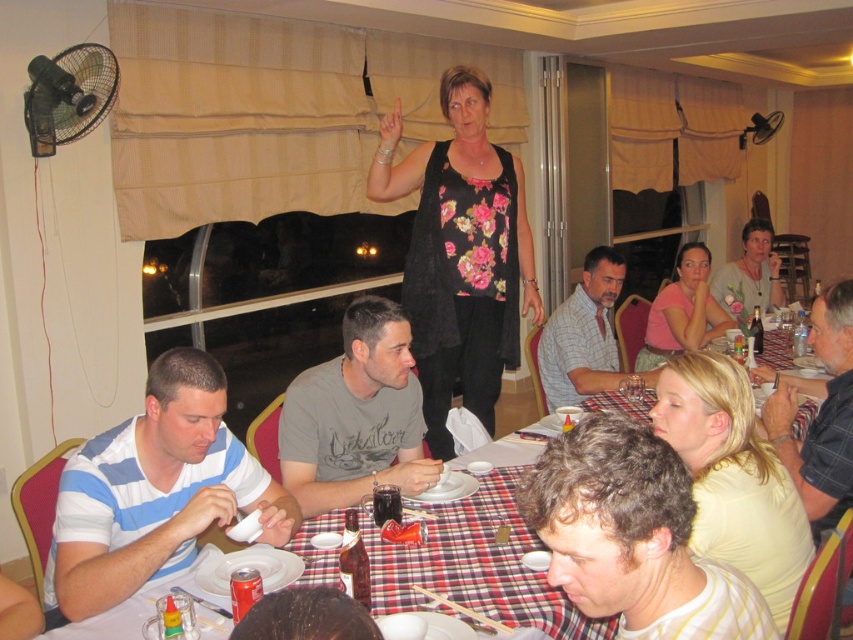
Question: Observing the image, what is the correct spatial positioning of floral print dress at center in reference to yellow cotton shirt at lower right?

Choices:
 (A) above
 (B) below

Answer: (A)

Question: Which of the following is the closest to the observer?

Choices:
 (A) (567, 396)
 (B) (659, 300)

Answer: (A)

Question: Estimate the real-world distances between objects in this image. Which object is farther from the pink matte shirt at lower right?

Choices:
 (A) floral fabric dress at upper center
 (B) plaid shirt at center
 (C) yellow cotton shirt at lower right

Answer: (C)

Question: Based on their relative distances, which object is farther from the plaid shirt at center?

Choices:
 (A) yellow cotton shirt at lower right
 (B) gray cotton shirt at center

Answer: (B)

Question: Is blue striped shirt at lower left thinner than pink matte shirt at lower right?

Choices:
 (A) no
 (B) yes

Answer: (A)

Question: Does curly hair at lower center appear on the left side of plaid shirt at center?

Choices:
 (A) no
 (B) yes

Answer: (B)